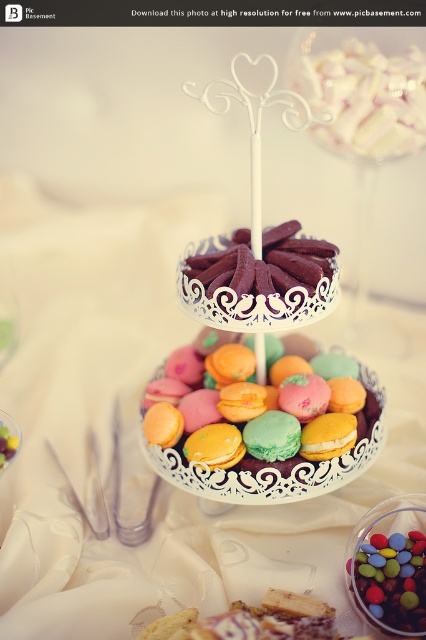
Question: Which of the following is the farthest from the observer?

Choices:
 (A) (377, 532)
 (B) (267, 557)

Answer: (B)

Question: Does pastel macarons at center appear under multicolored coated chocolate at center?

Choices:
 (A) yes
 (B) no

Answer: (B)

Question: Is white satin tablecloth at center above pastel macarons at center?

Choices:
 (A) no
 (B) yes

Answer: (B)

Question: Estimate the real-world distances between objects in this image. Which object is closer to the pastel macarons at center?

Choices:
 (A) multicolored coated chocolate at center
 (B) white satin tablecloth at center

Answer: (B)

Question: Does white satin tablecloth at center lie behind pastel macarons at center?

Choices:
 (A) no
 (B) yes

Answer: (A)

Question: Which object appears closest to the camera in this image?

Choices:
 (A) multicolored coated chocolate at center
 (B) white satin tablecloth at center
 (C) pastel macarons at center

Answer: (B)